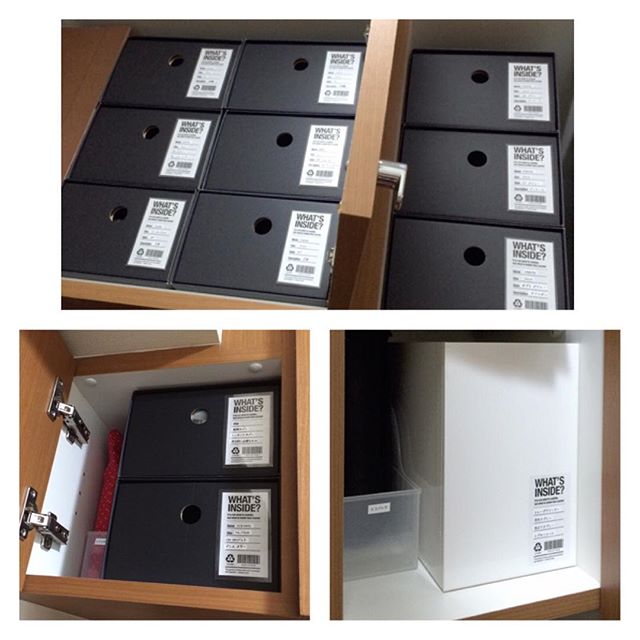
This screenshot has height=640, width=640. I want to click on cabinets, so pos(287,156), pos(217,499), pos(381,508).